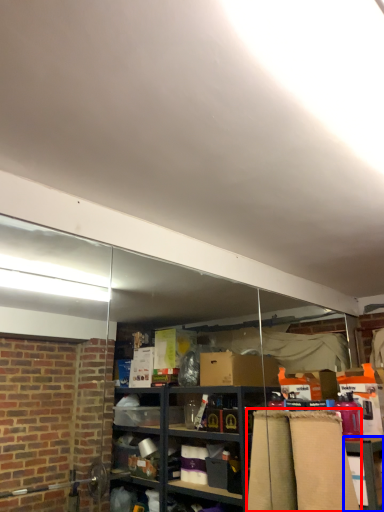
Question: Which of the following is the closest to the observer, curtain (highlighted by a red box) or table (highlighted by a blue box)?

Choices:
 (A) curtain
 (B) table

Answer: (A)